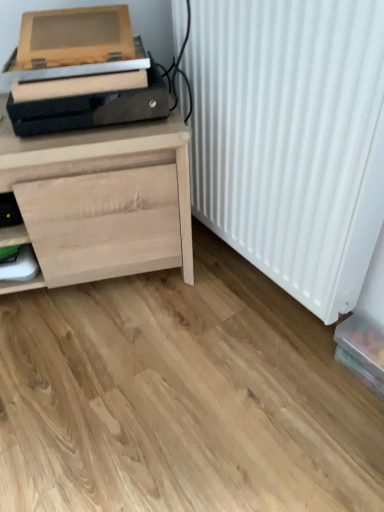
Locate an element on the screen. The image size is (384, 512). free space to the left of translucent plastic box at lower right is located at coordinates (302, 374).